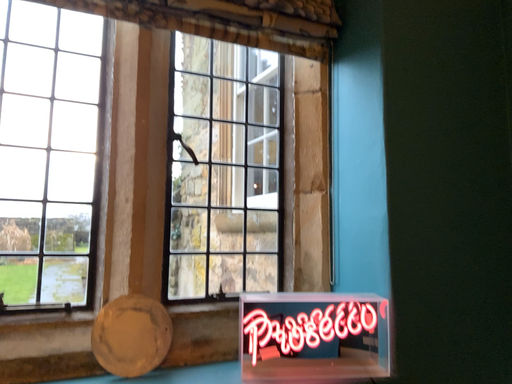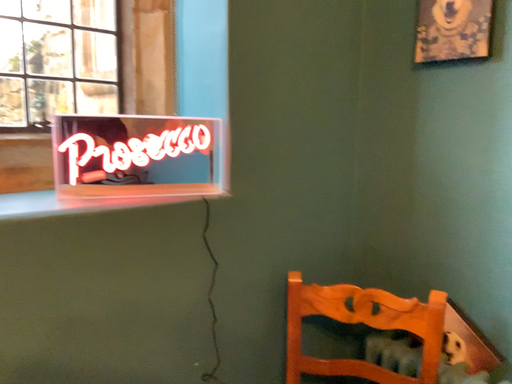
Question: Which way did the camera rotate in the video?

Choices:
 (A) rotated right
 (B) rotated left

Answer: (A)